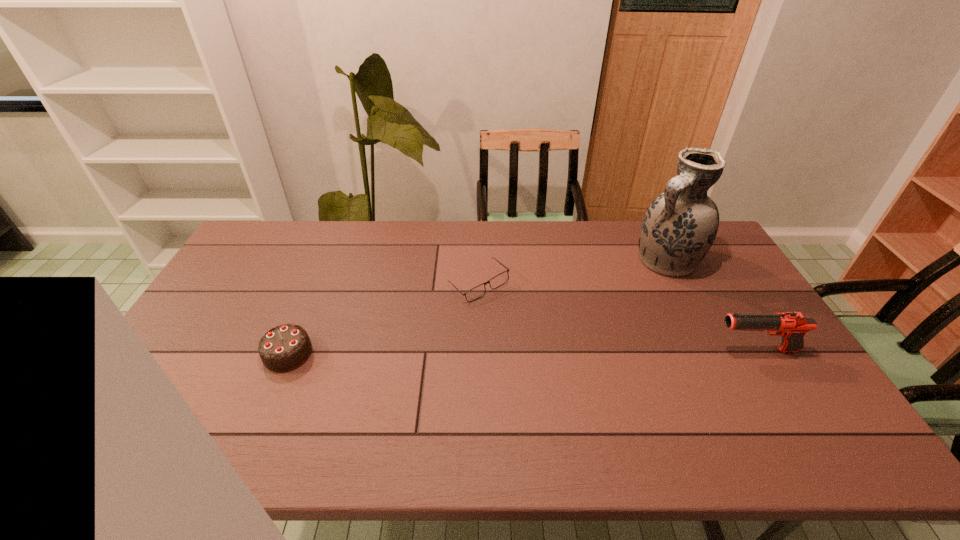
I want to click on free space located with the handle on the side of the vase, so click(x=607, y=307).

Locate an element on the screen. The image size is (960, 540). vacant point located with the handle on the side of the vase is located at coordinates (630, 289).

This screenshot has width=960, height=540. I want to click on blank space located 0.370m with the handle on the side of the vase, so click(x=577, y=329).

The image size is (960, 540). Find the location of `vacant space located with the lenses facing outward on the shortest object`. vacant space located with the lenses facing outward on the shortest object is located at coordinates (486, 335).

Where is `vacant space located 0.060m with the lenses facing outward on the shortest object`? vacant space located 0.060m with the lenses facing outward on the shortest object is located at coordinates (484, 318).

The image size is (960, 540). Identify the location of vacant region located with the lenses facing outward on the shortest object. (485, 325).

This screenshot has width=960, height=540. In order to click on object at the far edge in this screenshot , I will do 679,227.

Locate an element on the screen. gun at the right edge is located at coordinates (x=792, y=326).

Locate an element on the screen. The width and height of the screenshot is (960, 540). vase at the right edge is located at coordinates (679, 227).

This screenshot has height=540, width=960. I want to click on object present at the far right corner, so click(679, 227).